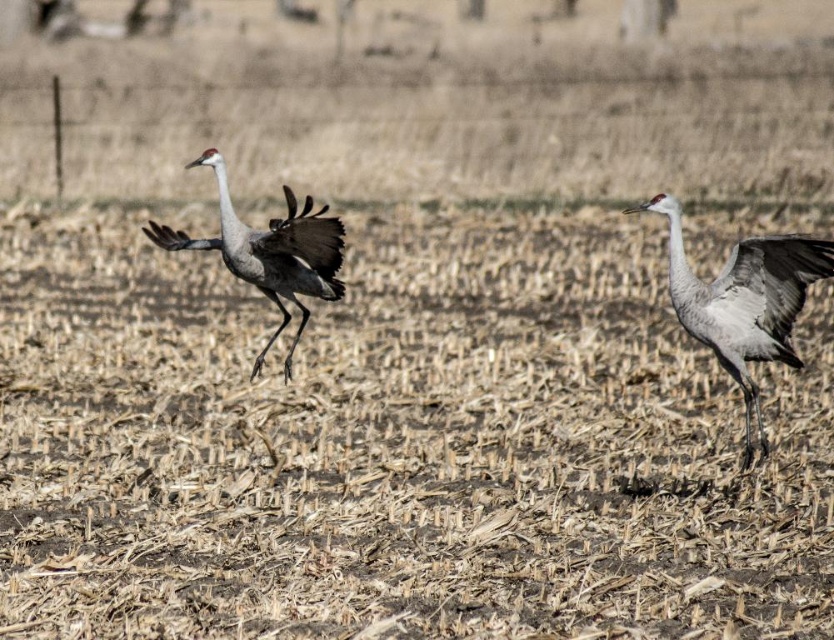
You are a birdwatcher observing two gray feathered cranes in a harvested field. You see the gray feathered crane at right and the gray feathered crane at center. Which crane is closer to you?

The gray feathered crane at right is closer to you because the gray feathered crane at center is behind it.

You are a wildlife photographer aiming to capture the crane with the wider body in the image. Which crane should you focus on, the gray feathered crane at right or the gray feathered crane at center?

The gray feathered crane at center is wider, so you should focus on the gray feathered crane at center to capture the crane with the wider body.